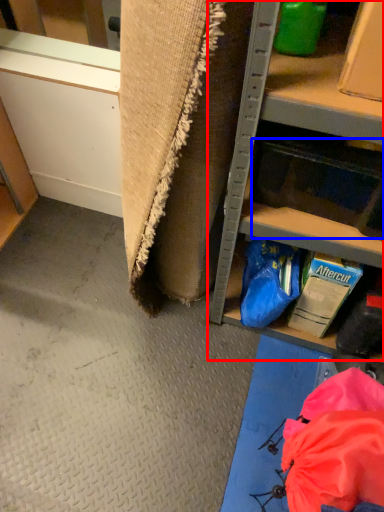
Question: Which object is further to the camera taking this photo, shelf (highlighted by a red box) or drawer (highlighted by a blue box)?

Choices:
 (A) shelf
 (B) drawer

Answer: (B)